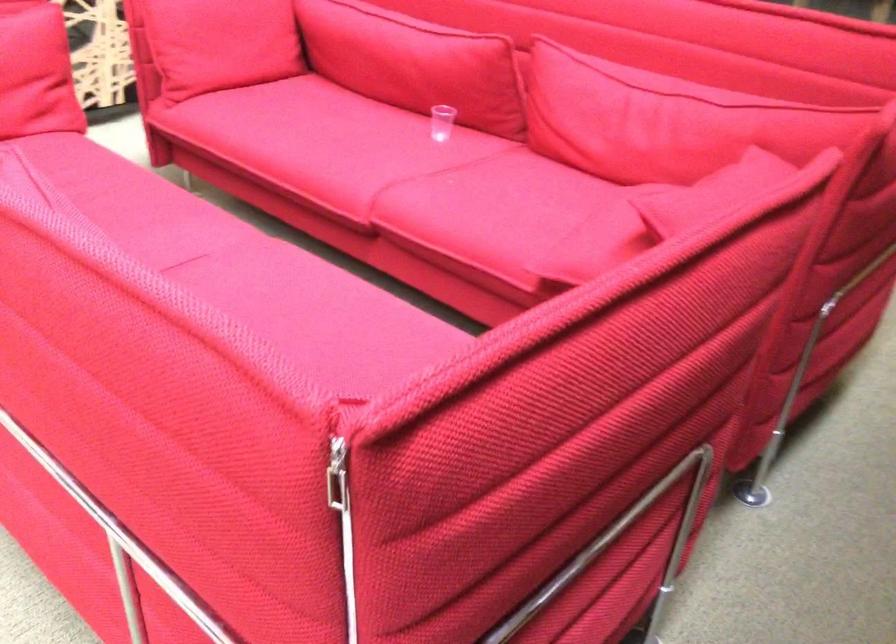
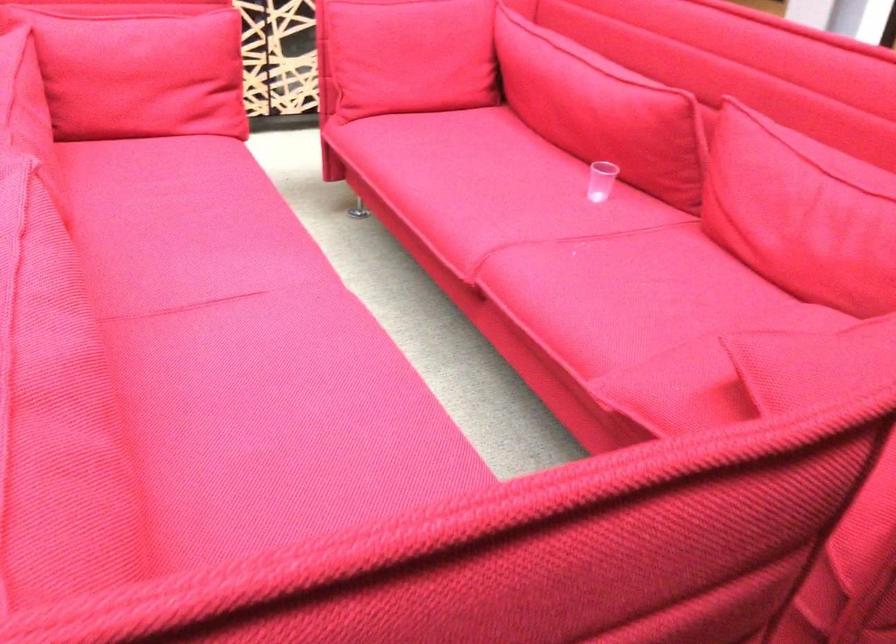
In the second image, find the point that corresponds to point (348, 144) in the first image.

(488, 192)